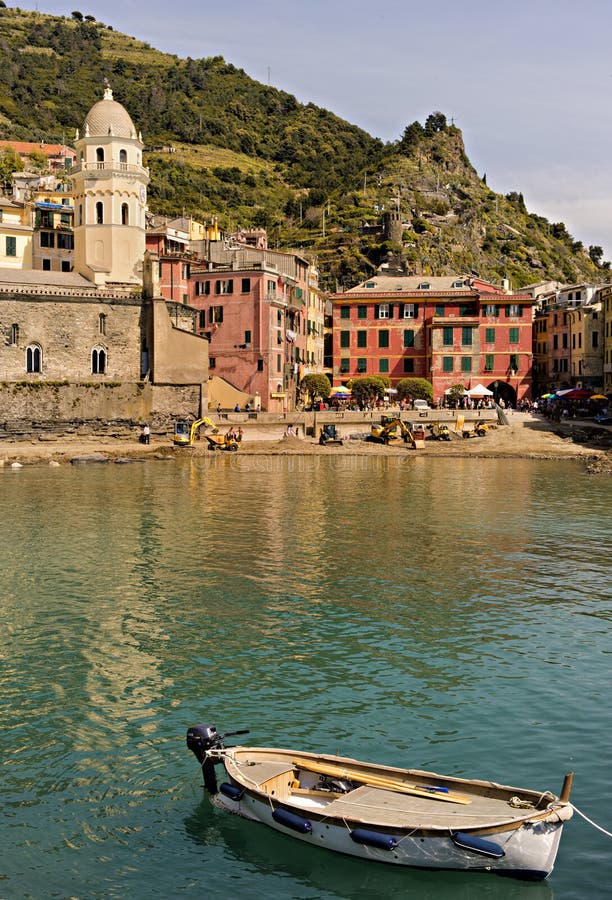
Where is `window`? Image resolution: width=612 pixels, height=900 pixels. window is located at coordinates (381, 338).